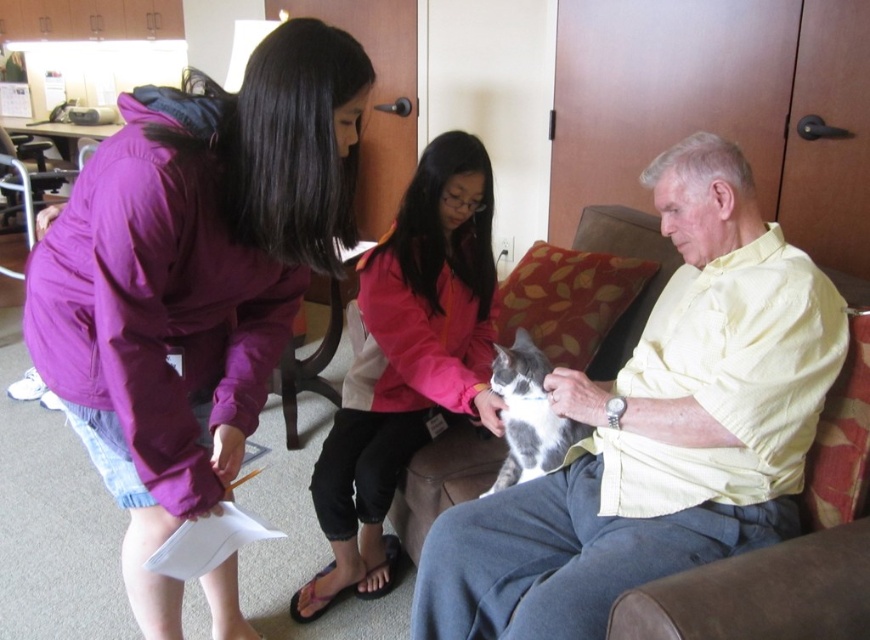
Question: Does purple fabric jacket at upper left appear over gray-white fur cat at center?

Choices:
 (A) yes
 (B) no

Answer: (A)

Question: Which of the following is the farthest from the observer?

Choices:
 (A) light yellow shirt at center
 (B) purple fabric jacket at upper left
 (C) gray-white fur cat at center

Answer: (C)

Question: Which object is farther from the camera taking this photo?

Choices:
 (A) gray-white fur cat at center
 (B) purple fabric jacket at upper left

Answer: (A)

Question: Can you confirm if purple fabric jacket at upper left is positioned to the right of gray-white fur cat at center?

Choices:
 (A) yes
 (B) no

Answer: (B)

Question: Which of the following is the closest to the observer?

Choices:
 (A) (106, 480)
 (B) (343, 461)
 (C) (617, 560)

Answer: (C)

Question: Does light yellow shirt at center have a larger size compared to pink fabric jacket at center?

Choices:
 (A) no
 (B) yes

Answer: (B)